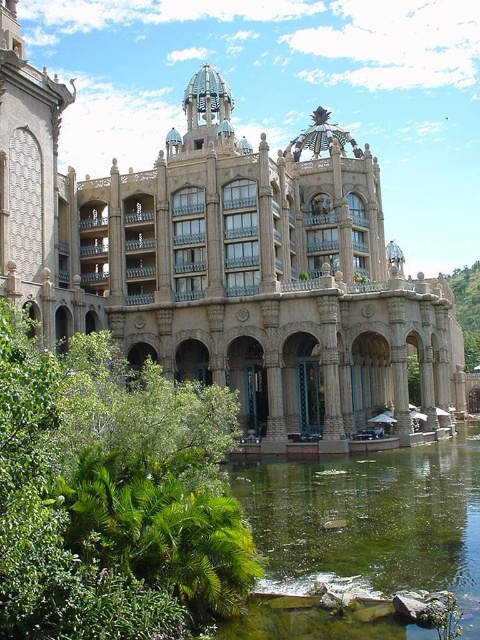
You are standing in front of the beige stone palace at center and want to walk towards the green leafy bush at lower left. Which direction should you face to move towards it?

You should face towards the lower left direction to move towards the green leafy bush at lower left since the beige stone palace at center is positioned over it.

Looking at this image, you are standing at the point closer to the building in the image. Which point are you at, point [222,358] or point [60,413]?

You are at point [60,413] because it is closer to the building than point [222,358], which is behind it.

You are standing at the entrance of the grand building and notice a green leafy bush at lower left and a green mossy pond at lower center. Which object is taller?

The green leafy bush at lower left is much taller than the green mossy pond at lower center.